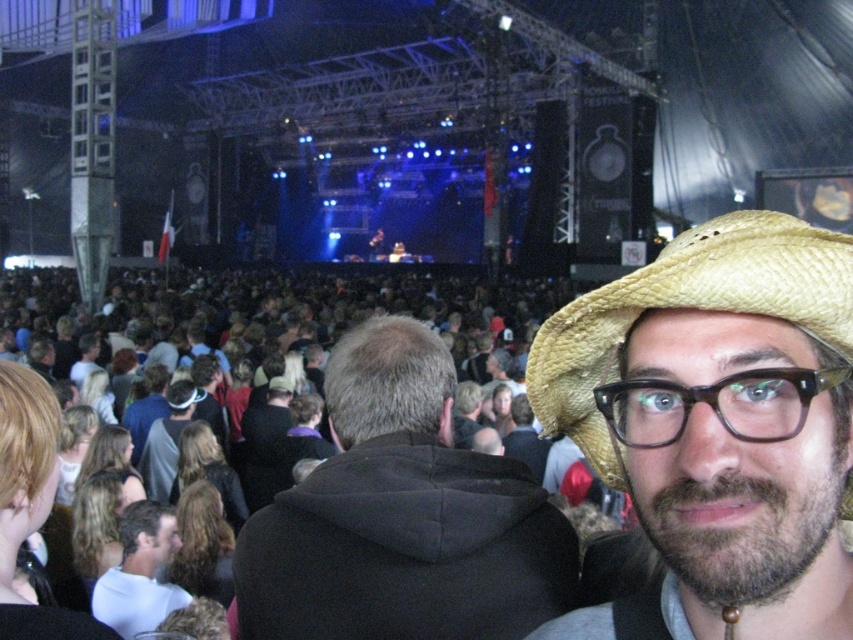
Question: Which of these objects is positioned closest to the dark blue hoodie at center?

Choices:
 (A) black plastic glasses at center
 (B) strawhat at right

Answer: (B)

Question: Based on their relative distances, which object is nearer to the strawhat at right?

Choices:
 (A) dark gray hoodie at center
 (B) black plastic glasses at center

Answer: (B)

Question: Which object is positioned closest to the white matte shirt at center?

Choices:
 (A) black fleece jacket at center
 (B) black plastic glasses at center
 (C) dark gray hoodie at center
 (D) strawhat at right

Answer: (A)

Question: Is strawhat at right below white matte shirt at center?

Choices:
 (A) no
 (B) yes

Answer: (A)

Question: Is black fleece jacket at center below strawhat at right?

Choices:
 (A) no
 (B) yes

Answer: (B)

Question: Is white matte shirt at center wider than dark gray hoodie at center?

Choices:
 (A) no
 (B) yes

Answer: (A)